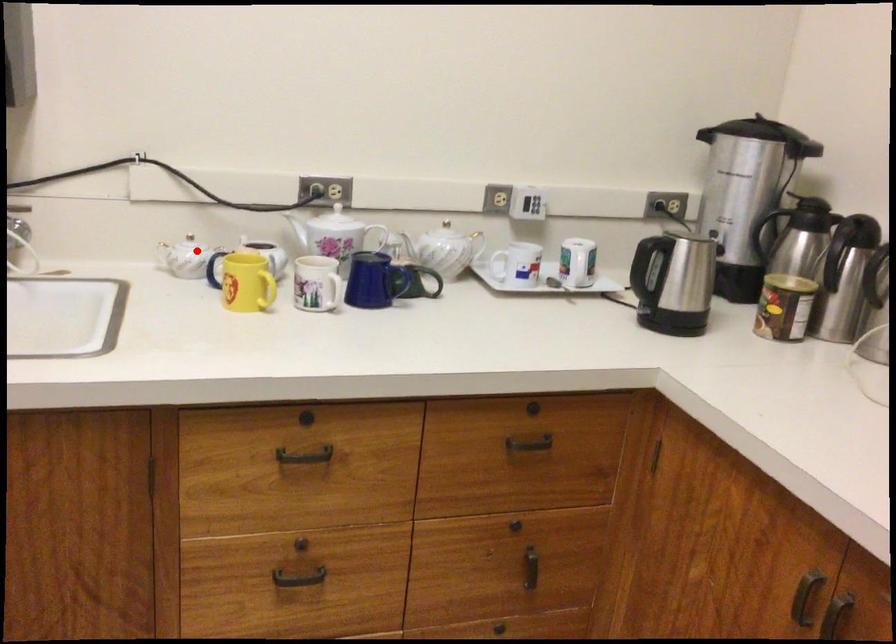
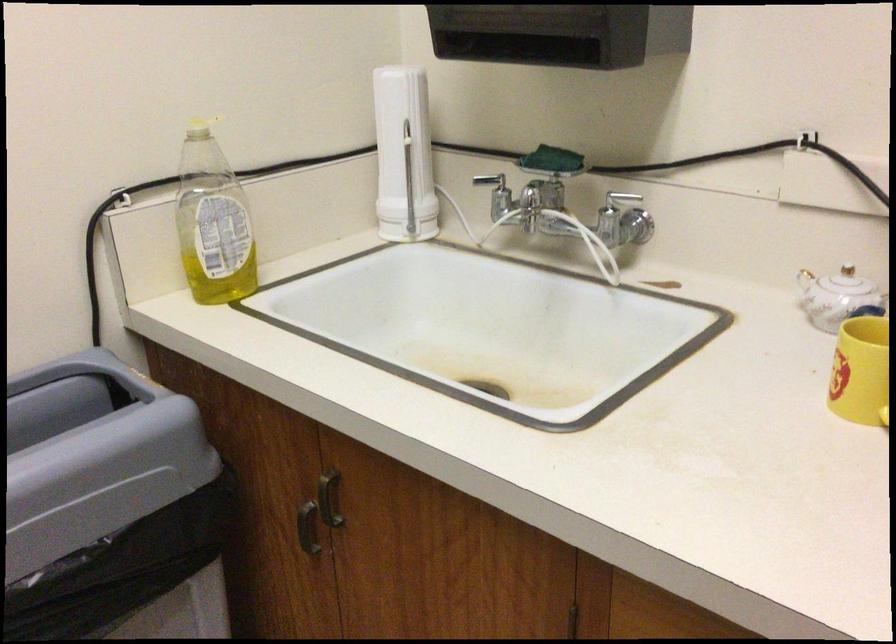
Question: I am providing you with two images of the same scene from different viewpoints. Given a red point in image1, look at the same physical point in image2. Is it:

Choices:
 (A) Closer to the viewpoint
 (B) Farther from the viewpoint

Answer: (A)